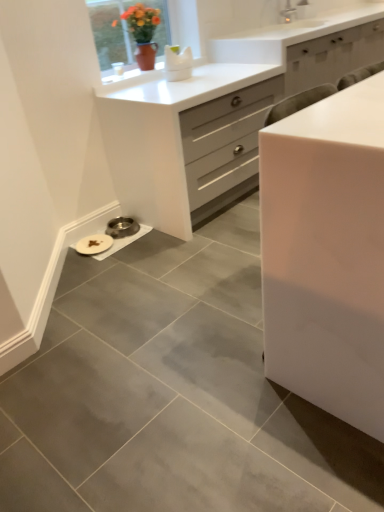
Question: Is white glossy cabinet at center, which is counted as the 2th chest of drawers, starting from the back, wider or thinner than white glossy chest of drawers at center, placed as the second chest of drawers when sorted from front to back?

Choices:
 (A) wide
 (B) thin

Answer: (B)

Question: From the image's perspective, is white glossy cabinet at center, marked as the first chest of drawers in a front-to-back arrangement, positioned above or below white glossy chest of drawers at center, the first chest of drawers when ordered from back to front?

Choices:
 (A) above
 (B) below

Answer: (B)

Question: Which object is the closest to the matte ceramic vase at upper center?

Choices:
 (A) white glossy chest of drawers at center, placed as the second chest of drawers when sorted from front to back
 (B) white glossy cabinet at center, marked as the first chest of drawers in a front-to-back arrangement

Answer: (A)

Question: Which object is the farthest from the white glossy chest of drawers at center, the first chest of drawers when ordered from back to front?

Choices:
 (A) white glossy cabinet at center, which is counted as the 2th chest of drawers, starting from the back
 (B) matte ceramic vase at upper center

Answer: (A)